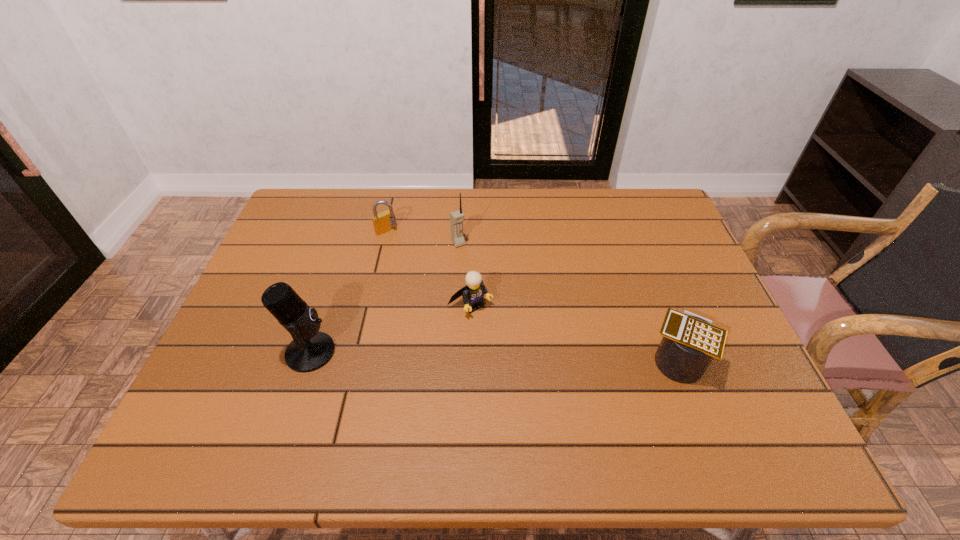
I want to click on vacant space in between the fourth shortest object and the calculator, so click(x=567, y=301).

Select which object is the closest to the fourth shortest object. Please provide its 2D coordinates. Your answer should be formatted as a tuple, i.e. [(x, y)], where the tuple contains the x and y coordinates of a point satisfying the conditions above.

[(473, 293)]

Identify the location of the second closest object to the second object from left to right. (473, 293).

Image resolution: width=960 pixels, height=540 pixels. Identify the location of vacant space that satisfies the following two spatial constraints: 1. on the front side of the fourth shortest object; 2. on the right side of the farthest object. (383, 243).

I want to click on free location that satisfies the following two spatial constraints: 1. on the front side of the Lego; 2. on the right side of the calculator, so click(x=469, y=360).